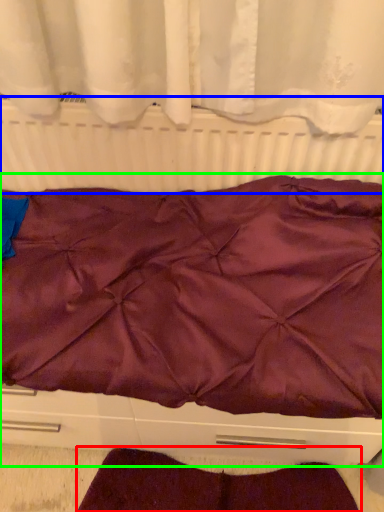
Question: Which object is positioned farthest from blanket (highlighted by a red box)? Select from radiator (highlighted by a blue box) and furniture (highlighted by a green box).

Choices:
 (A) radiator
 (B) furniture

Answer: (A)